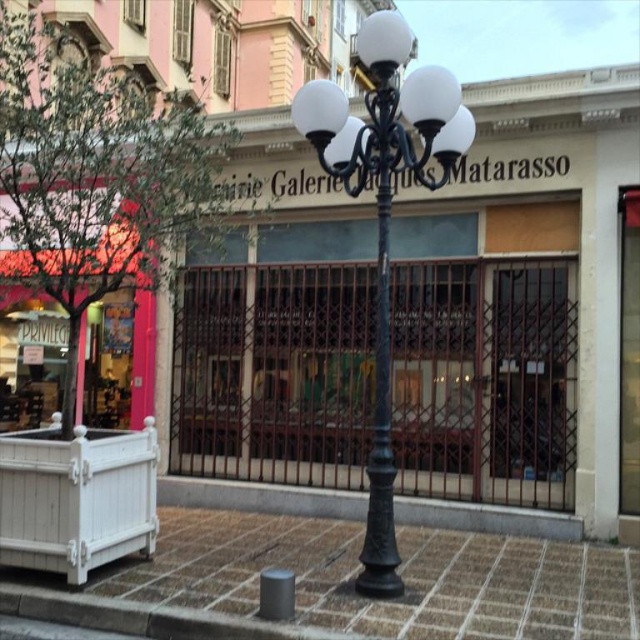
Based on the scene description, where is the brick paved sidewalk at center located in the image?

The brick paved sidewalk at center is located at point 2D coordinates of (401,572).

You are standing in front of the Galerie Jacques Matarasso and need to place a small potted plant. The plant must be placed on the brick paved sidewalk at center but also needs to be under the black metal streetlight at center for shade. Is this possible?

The brick paved sidewalk at center is located below black metal streetlight at center, so yes, placing the plant there would put it both on the sidewalk and under the streetlight.